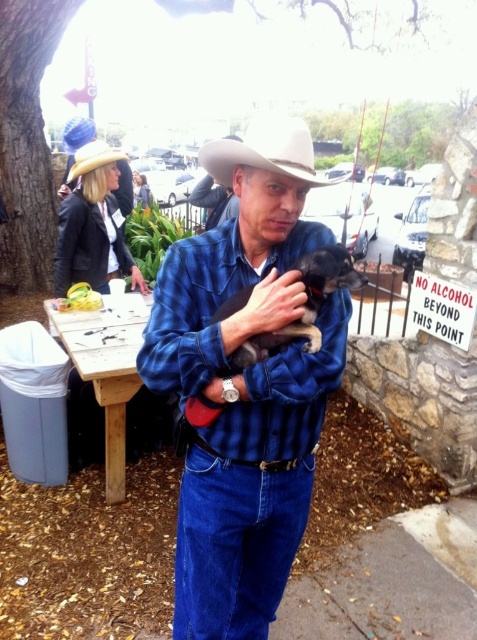
Question: Does blue plaid shirt at center appear under white matte cowboy hat at center?

Choices:
 (A) no
 (B) yes

Answer: (B)

Question: Among these objects, which one is nearest to the camera?

Choices:
 (A) black fur dog at center
 (B) yellow felt fedora at upper left

Answer: (A)

Question: Which object is farther from the camera taking this photo?

Choices:
 (A) black fur dog at center
 (B) yellow felt fedora at upper left
 (C) white matte cowboy hat at center

Answer: (B)

Question: Does black fur dog at center have a smaller size compared to yellow felt fedora at upper left?

Choices:
 (A) no
 (B) yes

Answer: (A)

Question: Which object appears farthest from the camera in this image?

Choices:
 (A) blue plaid shirt at center
 (B) black fur dog at center
 (C) white matte cowboy hat at center

Answer: (C)

Question: In this image, where is black fur dog at center located relative to white matte cowboy hat at center?

Choices:
 (A) above
 (B) below

Answer: (B)